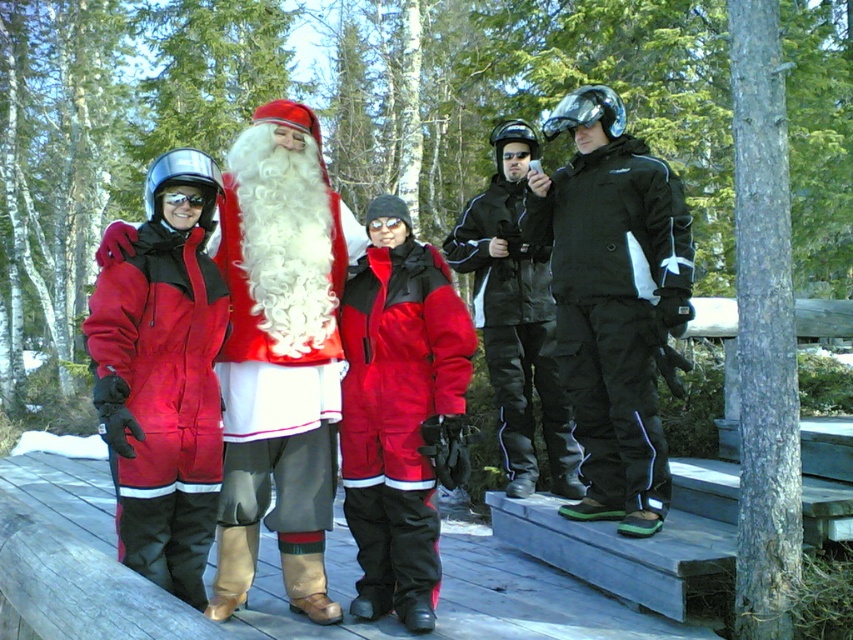
You are an observer standing in the snowy forest scene. You see the red velvet santa at left and the matte red snowsuit at left. Which object is positioned more to the right?

The red velvet santa at left is positioned more to the right than the matte red snowsuit at left.

Looking at this image, you are a photographer trying to capture a photo of the matte red snowsuit at left and the matte red snowsuit at center. Based on their positions, which one is higher up in the frame?

The matte red snowsuit at left is above the matte red snowsuit at center, so it is higher up in the frame.

Looking at this image, you are a photographer trying to arrange two people wearing matte red snowsuits for a group photo. The matte red snowsuit at left and the matte red snowsuit at center are both in the frame. Based on their heights, which one should you position closer to the camera to ensure both appear equally tall in the photo?

The matte red snowsuit at left is taller than the matte red snowsuit at center. To make them appear equally tall in the photo, position the shorter matte red snowsuit at center closer to the camera.